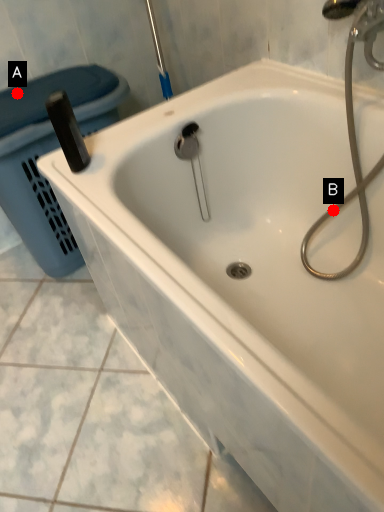
Question: Two points are circled on the image, labeled by A and B beside each circle. Which point is closer to the camera?

Choices:
 (A) A is closer
 (B) B is closer

Answer: (B)